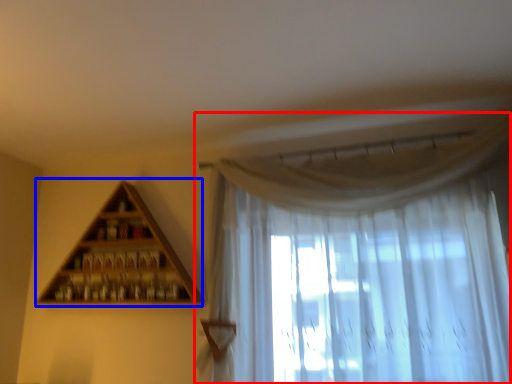
Question: Which of the following is the farthest to the observer, curtain (highlighted by a red box) or shelf (highlighted by a blue box)?

Choices:
 (A) curtain
 (B) shelf

Answer: (B)